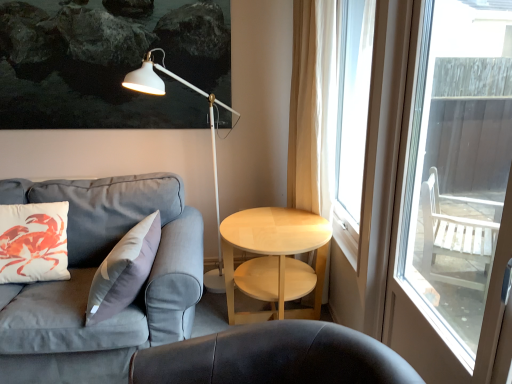
What is the approximate width of white matte floor lamp at upper center?

white matte floor lamp at upper center is 32.25 inches in width.

The height and width of the screenshot is (384, 512). Describe the element at coordinates (312, 107) in the screenshot. I see `white sheer curtain at right` at that location.

Where is `gray fabric couch at left`? gray fabric couch at left is located at coordinates (92, 278).

I want to click on white matte floor lamp at upper center, so click(x=211, y=138).

From a real-world perspective, which is physically below, white sheer curtain at right or white glossy table at right?

white glossy table at right is physically lower.

Does white sheer curtain at right lie behind white glossy table at right?

Yes, white sheer curtain at right is further from the viewer.

Do you think white sheer curtain at right is within white glossy table at right, or outside of it?

white sheer curtain at right is located beyond the bounds of white glossy table at right.

Does white sheer curtain at right have a lesser width compared to white glossy table at right?

Indeed, white sheer curtain at right has a lesser width compared to white glossy table at right.

Is transparent glass door at right aimed at white sheer curtain at right?

No, transparent glass door at right does not turn towards white sheer curtain at right.

Consider the image. From a real-world perspective, is transparent glass door at right positioned over white sheer curtain at right based on gravity?

Yes, from a real-world perspective, transparent glass door at right is above white sheer curtain at right.

The image size is (512, 384). I want to click on window that appears above the white sheer curtain at right (from a real-world perspective), so click(x=453, y=192).

Where is `lamp below the white sheer curtain at right (from a real-world perspective)`? The image size is (512, 384). lamp below the white sheer curtain at right (from a real-world perspective) is located at coordinates (211, 138).

From a real-world perspective, does white matte floor lamp at upper center sit lower than white sheer curtain at right?

Correct, in the physical world, white matte floor lamp at upper center is lower than white sheer curtain at right.

Is white matte floor lamp at upper center in contact with white sheer curtain at right?

No, white matte floor lamp at upper center is not with white sheer curtain at right.

Which object is positioned more to the left, white matte floor lamp at upper center or white sheer curtain at right?

white matte floor lamp at upper center is more to the left.

Is white glossy table at right facing away from white sheer curtain at right?

white glossy table at right is not turned away from white sheer curtain at right.

Between white glossy table at right and white sheer curtain at right, which one has larger width?

white glossy table at right.

Is white glossy table at right not near white sheer curtain at right?

They are positioned close to each other.

From the image's perspective, who appears lower, transparent glass door at right or white sheer curtain at right?

transparent glass door at right appears lower in the image.

Is transparent glass door at right in front of or behind white sheer curtain at right in the image?

Visually, transparent glass door at right is located in front of white sheer curtain at right.

Considering the sizes of objects transparent glass door at right and white sheer curtain at right in the image provided, who is taller, transparent glass door at right or white sheer curtain at right?

Standing taller between the two is white sheer curtain at right.

Where is `window screen above the transparent glass door at right (from the image's perspective)`? window screen above the transparent glass door at right (from the image's perspective) is located at coordinates (352, 119).

Is white glossy table at right turned away from white sheer curtain at right?

No, white glossy table at right is not facing the opposite direction of white sheer curtain at right.

Can you confirm if white glossy table at right is smaller than white sheer curtain at right?

No.

Can you confirm if white glossy table at right is thinner than white sheer curtain at right?

Incorrect, the width of white glossy table at right is not less than that of white sheer curtain at right.

Considering the sizes of objects white sheer curtain at right and gray fabric couch at left in the image provided, who is taller, white sheer curtain at right or gray fabric couch at left?

white sheer curtain at right is taller.

What are the coordinates of `studio couch that is on the left side of white sheer curtain at right` in the screenshot? It's located at (92, 278).

From the image's perspective, is white sheer curtain at right on gray fabric couch at left?

Correct, white sheer curtain at right appears higher than gray fabric couch at left in the image.

Are white sheer curtain at right and gray fabric couch at left making contact?

No.

Identify the location of curtain to the right of white glossy table at right. (x=312, y=107).

Identify the location of curtain that appears behind the transparent glass door at right. The image size is (512, 384). (312, 107).

Which object lies nearer to the anchor point transparent glass door at right, white sheer curtain at right or gray fabric couch at left?

white sheer curtain at right is closer to transparent glass door at right.

Estimate the real-world distances between objects in this image. Which object is further from white matte pillow at left, white glossy table at right or gray fabric couch at left?

white glossy table at right lies further to white matte pillow at left than the other object.

Considering their positions, is white glossy table at right positioned closer to transparent glass door at right than gray fabric couch at left?

white glossy table at right.

Based on the photo, based on their spatial positions, is white sheer curtain at right or white matte pillow at left closer to transparent glass door at right?

white sheer curtain at right lies closer to transparent glass door at right than the other object.

When comparing their distances from transparent glass door at right, does white matte floor lamp at upper center or white sheer curtain at right seem further?

white matte floor lamp at upper center.

Which object lies further to the anchor point white glossy table at right, white sheer curtain at right or white matte pillow at left?

Based on the image, white matte pillow at left appears to be further to white glossy table at right.

Based on their spatial positions, is white sheer curtain at right or white sheer curtain at right further from white glossy table at right?

white sheer curtain at right.

Looking at the image, which one is located closer to gray fabric couch at left, white matte floor lamp at upper center or transparent glass door at right?

white matte floor lamp at upper center is positioned closer to the anchor gray fabric couch at left.

Locate an element on the screen. table between gray fabric couch at left and transparent glass door at right in the horizontal direction is located at coordinates (275, 260).

In order to click on curtain between white sheer curtain at right and white glossy table at right in the up-down direction in this screenshot , I will do `click(312, 107)`.

Locate an element on the screen. window screen between white matte pillow at left and transparent glass door at right from left to right is located at coordinates (352, 119).

The width and height of the screenshot is (512, 384). Identify the location of lamp between white matte pillow at left and white sheer curtain at right in the horizontal direction. (211, 138).